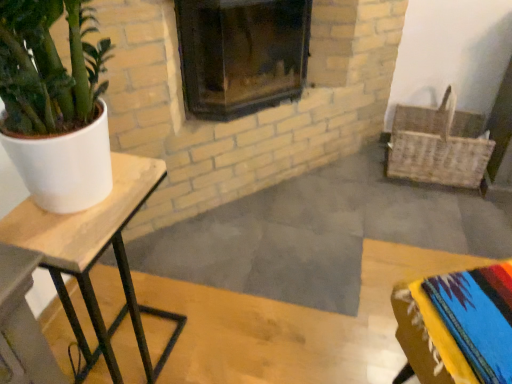
Image resolution: width=512 pixels, height=384 pixels. I want to click on vacant area to the right of wooden table at left, so click(x=223, y=340).